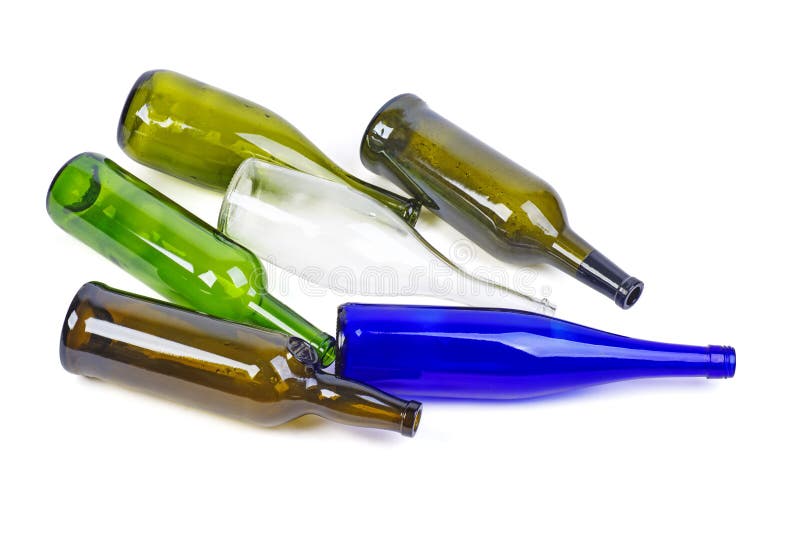
At what (x,y) coordinates should I click in order to perform the action: click on glass bottles. Please return your answer as a coordinate pair (x, y). Looking at the image, I should click on (210, 255), (301, 219), (258, 149), (470, 155), (460, 342), (212, 367).